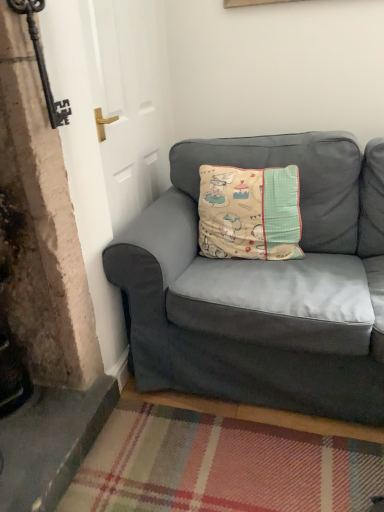
What do you see at coordinates (263, 285) in the screenshot? This screenshot has width=384, height=512. I see `suede gray couch at lower right` at bounding box center [263, 285].

You are a GUI agent. You are given a task and a screenshot of the screen. Output one action in this format:
    pyautogui.click(x=<x>, y=<y>)
    Task: Click on the suede gray couch at lower right
    
    Given the screenshot: What is the action you would take?
    pyautogui.click(x=263, y=285)

Image resolution: width=384 pixels, height=512 pixels. In order to click on beige fabric cushion at center in this screenshot , I will do `click(249, 213)`.

The image size is (384, 512). What do you see at coordinates (249, 213) in the screenshot? I see `beige fabric cushion at center` at bounding box center [249, 213].

The height and width of the screenshot is (512, 384). I want to click on suede gray couch at lower right, so click(263, 285).

Between beige fabric cushion at center and suede gray couch at lower right, which one appears on the right side from the viewer's perspective?

suede gray couch at lower right is more to the right.

Which object is further away from the camera taking this photo, beige fabric cushion at center or suede gray couch at lower right?

beige fabric cushion at center is behind.

Between point (263, 243) and point (205, 263), which one is positioned in front?

Positioned in front is point (205, 263).

From the image's perspective, is beige fabric cushion at center located above suede gray couch at lower right?

Yes, from the image's perspective, beige fabric cushion at center is above suede gray couch at lower right.

From a real-world perspective, is beige fabric cushion at center positioned over suede gray couch at lower right based on gravity?

Correct, in the physical world, beige fabric cushion at center is higher than suede gray couch at lower right.

Which object is wider, beige fabric cushion at center or suede gray couch at lower right?

suede gray couch at lower right.

Between beige fabric cushion at center and suede gray couch at lower right, which one has less height?

With less height is beige fabric cushion at center.

Considering the sizes of objects beige fabric cushion at center and suede gray couch at lower right in the image provided, who is smaller, beige fabric cushion at center or suede gray couch at lower right?

beige fabric cushion at center is smaller.

Is beige fabric cushion at center surrounding suede gray couch at lower right?

No.

Consider the image. Is beige fabric cushion at center placed right next to suede gray couch at lower right?

They are not placed beside each other.

Is beige fabric cushion at center looking in the opposite direction of suede gray couch at lower right?

Yes, suede gray couch at lower right is at the back of beige fabric cushion at center.

How many degrees apart are the facing directions of beige fabric cushion at center and suede gray couch at lower right?

The angle between the facing direction of beige fabric cushion at center and the facing direction of suede gray couch at lower right is 5.84 degrees.

This screenshot has height=512, width=384. I want to click on studio couch that is under the beige fabric cushion at center (from a real-world perspective), so click(263, 285).

Considering the positions of objects suede gray couch at lower right and beige fabric cushion at center in the image provided, who is more to the right, suede gray couch at lower right or beige fabric cushion at center?

From the viewer's perspective, suede gray couch at lower right appears more on the right side.

In the image, is suede gray couch at lower right positioned in front of or behind beige fabric cushion at center?

suede gray couch at lower right is positioned closer to the viewer than beige fabric cushion at center.

Considering the positions of point (173, 259) and point (206, 170), is point (173, 259) closer or farther from the camera than point (206, 170)?

Point (173, 259) appears to be closer to the viewer than point (206, 170).

From the image's perspective, is suede gray couch at lower right beneath beige fabric cushion at center?

Yes, from the image's perspective, suede gray couch at lower right is below beige fabric cushion at center.

From a real-world perspective, who is located lower, suede gray couch at lower right or beige fabric cushion at center?

In real-world perspective, suede gray couch at lower right is lower.

Which object is thinner, suede gray couch at lower right or beige fabric cushion at center?

Thinner between the two is beige fabric cushion at center.

Can you confirm if suede gray couch at lower right is taller than beige fabric cushion at center?

Correct, suede gray couch at lower right is much taller as beige fabric cushion at center.

Considering the sizes of objects suede gray couch at lower right and beige fabric cushion at center in the image provided, who is bigger, suede gray couch at lower right or beige fabric cushion at center?

suede gray couch at lower right.

Is suede gray couch at lower right inside or outside of beige fabric cushion at center?

suede gray couch at lower right exists outside the volume of beige fabric cushion at center.

Are suede gray couch at lower right and beige fabric cushion at center far apart?

No.

Is suede gray couch at lower right oriented towards beige fabric cushion at center?

Yes, suede gray couch at lower right faces towards beige fabric cushion at center.

How many degrees apart are the facing directions of suede gray couch at lower right and beige fabric cushion at center?

The angle between the facing direction of suede gray couch at lower right and the facing direction of beige fabric cushion at center is 5.84 degrees.

Identify the location of pillow lying on the left of suede gray couch at lower right. The width and height of the screenshot is (384, 512). (249, 213).

Where is `studio couch in front of the beige fabric cushion at center`? The height and width of the screenshot is (512, 384). studio couch in front of the beige fabric cushion at center is located at coordinates (263, 285).

This screenshot has height=512, width=384. Find the location of `studio couch located underneath the beige fabric cushion at center (from a real-world perspective)`. studio couch located underneath the beige fabric cushion at center (from a real-world perspective) is located at coordinates (263, 285).